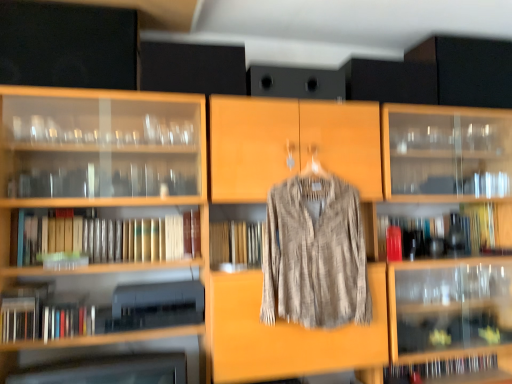
What do you see at coordinates (174, 237) in the screenshot? Image resolution: width=512 pixels, height=384 pixels. I see `white paper book at center, the first book from the left` at bounding box center [174, 237].

Describe the element at coordinates (480, 225) in the screenshot. I see `yellow paperback book at right, which is counted as the 4th book, starting from the bottom` at that location.

Locate an element on the screen. The width and height of the screenshot is (512, 384). wooden book at center, placed as the second book when sorted from bottom to top is located at coordinates (234, 243).

Describe the element at coordinates (315, 254) in the screenshot. I see `textured beige shirt at center` at that location.

What do you see at coordinates (438, 369) in the screenshot? The height and width of the screenshot is (384, 512). I see `hardcover book at lower right, arranged as the fourth book when viewed from the top` at bounding box center [438, 369].

Identify the location of white paper book at center, which ranks as the 2th book in top-to-bottom order. Image resolution: width=512 pixels, height=384 pixels. (174, 237).

From the image's perspective, is wooden bookshelf at lower left positioned above or below wooden book at center, which ranks as the third book in right-to-left order?

wooden bookshelf at lower left is below wooden book at center, which ranks as the third book in right-to-left order.

Which point is more distant from viewer, (20,352) or (228,240)?

The point (228,240) is behind.

Is wooden bookshelf at lower left located outside wooden book at center, the second book from the left?

Yes, wooden bookshelf at lower left is outside of wooden book at center, the second book from the left.

Is wooden bookshelf at lower left wider than wooden book at center, placed as the second book when sorted from bottom to top?

Correct, the width of wooden bookshelf at lower left exceeds that of wooden book at center, placed as the second book when sorted from bottom to top.

From the image's perspective, relative to textured beige shirt at center, is wooden bookshelf at lower left above or below?

Clearly, from the image's perspective, wooden bookshelf at lower left is below textured beige shirt at center.

Are wooden bookshelf at lower left and textured beige shirt at center far apart?

wooden bookshelf at lower left is actually quite close to textured beige shirt at center.

Who is taller, wooden bookshelf at lower left or textured beige shirt at center?

Standing taller between the two is textured beige shirt at center.

Between yellow paperback book at right, the 1th book when ordered from right to left, and white paper book at center, the first book from the left, which one has smaller size?

Smaller between the two is white paper book at center, the first book from the left.

Who is more distant, yellow paperback book at right, the fourth book in the left-to-right sequence, or white paper book at center, the first book from the left?

yellow paperback book at right, the fourth book in the left-to-right sequence.

Considering the relative positions of yellow paperback book at right, the fourth book in the left-to-right sequence, and white paper book at center, the first book from the left, in the image provided, is yellow paperback book at right, the fourth book in the left-to-right sequence, to the left of white paper book at center, the first book from the left, from the viewer's perspective?

In fact, yellow paperback book at right, the fourth book in the left-to-right sequence, is to the right of white paper book at center, the first book from the left.

Is yellow paperback book at right, the 1th book when ordered from top to bottom, oriented away from white paper book at center, arranged as the 4th book when viewed from the right?

yellow paperback book at right, the 1th book when ordered from top to bottom, is not turned away from white paper book at center, arranged as the 4th book when viewed from the right.

Where is `shelf in front of the wooden book at center, the second book from the left`? This screenshot has width=512, height=384. shelf in front of the wooden book at center, the second book from the left is located at coordinates (115, 363).

Is wooden book at center, placed as the second book when sorted from bottom to top, far away from wooden bookshelf at lower left?

Actually, wooden book at center, placed as the second book when sorted from bottom to top, and wooden bookshelf at lower left are a little close together.

From the image's perspective, which is below, wooden book at center, placed as the second book when sorted from bottom to top, or wooden bookshelf at lower left?

wooden bookshelf at lower left.

Which object is wider, wooden book at center, the second book from the left, or wooden bookshelf at lower left?

wooden bookshelf at lower left is wider.

How distant is white paper book at center, the first book from the left, from hardcover book at lower right, which is the 1th book in bottom-to-top order?

white paper book at center, the first book from the left, and hardcover book at lower right, which is the 1th book in bottom-to-top order, are 1.43 meters apart from each other.

Considering the positions of objects white paper book at center, which ranks as the 2th book in top-to-bottom order, and hardcover book at lower right, acting as the second book starting from the right, in the image provided, who is in front, white paper book at center, which ranks as the 2th book in top-to-bottom order, or hardcover book at lower right, acting as the second book starting from the right,?

white paper book at center, which ranks as the 2th book in top-to-bottom order, is in front.

From the image's perspective, is white paper book at center, which ranks as the 2th book in top-to-bottom order, located above or below hardcover book at lower right, acting as the second book starting from the right?

white paper book at center, which ranks as the 2th book in top-to-bottom order, is situated higher than hardcover book at lower right, acting as the second book starting from the right, in the image.

Considering the sizes of objects white paper book at center, which is the 3th book in bottom-to-top order, and hardcover book at lower right, which is the 1th book in bottom-to-top order, in the image provided, who is wider, white paper book at center, which is the 3th book in bottom-to-top order, or hardcover book at lower right, which is the 1th book in bottom-to-top order,?

white paper book at center, which is the 3th book in bottom-to-top order.

Considering the relative sizes of white paper book at center, the first book from the left, and wooden bookshelf at lower left in the image provided, is white paper book at center, the first book from the left, taller than wooden bookshelf at lower left?

No.

Is white paper book at center, which is the 3th book in bottom-to-top order, situated inside wooden bookshelf at lower left or outside?

white paper book at center, which is the 3th book in bottom-to-top order, is located beyond the bounds of wooden bookshelf at lower left.

Can you confirm if white paper book at center, which is the 3th book in bottom-to-top order, is bigger than wooden bookshelf at lower left?

No.

Is white paper book at center, arranged as the 4th book when viewed from the right, with wooden bookshelf at lower left?

No, white paper book at center, arranged as the 4th book when viewed from the right, is not making contact with wooden bookshelf at lower left.

Is wooden book at center, the second book from the left, turned away from white paper book at center, the first book from the left?

No, white paper book at center, the first book from the left, is not at the back of wooden book at center, the second book from the left.

Which of these two, wooden book at center, placed as the second book when sorted from bottom to top, or white paper book at center, arranged as the 4th book when viewed from the right, stands shorter?

With less height is white paper book at center, arranged as the 4th book when viewed from the right.

Is wooden book at center, which ranks as the third book in right-to-left order, not near white paper book at center, the first book from the left?

No.

In terms of width, does wooden book at center, the second book from the left, look wider or thinner when compared to white paper book at center, the first book from the left?

wooden book at center, the second book from the left, is wider than white paper book at center, the first book from the left.

Locate an element on the screen. shelf below the wooden book at center, placed as the second book when sorted from bottom to top (from a real-world perspective) is located at coordinates (115, 363).

Find the location of a particular element. shelf below the textured beige shirt at center (from the image's perspective) is located at coordinates pos(115,363).

Considering their positions, is textured beige shirt at center positioned further to yellow paperback book at right, which is counted as the 4th book, starting from the bottom, than wooden book at center, which ranks as the third book in right-to-left order?

wooden book at center, which ranks as the third book in right-to-left order, is positioned further to the anchor yellow paperback book at right, which is counted as the 4th book, starting from the bottom.

From the image, which object appears to be nearer to wooden bookshelf at lower left, hardcover book at lower right, acting as the second book starting from the right, or textured beige shirt at center?

Among the two, textured beige shirt at center is located nearer to wooden bookshelf at lower left.

Which object lies nearer to the anchor point white paper book at center, arranged as the 4th book when viewed from the right, wooden bookshelf at lower left or textured beige shirt at center?

Based on the image, wooden bookshelf at lower left appears to be nearer to white paper book at center, arranged as the 4th book when viewed from the right.

Considering their positions, is white paper book at center, which is the 3th book in bottom-to-top order, positioned closer to yellow paperback book at right, the 1th book when ordered from right to left, than hardcover book at lower right, which is the 1th book in bottom-to-top order?

hardcover book at lower right, which is the 1th book in bottom-to-top order, is positioned closer to the anchor yellow paperback book at right, the 1th book when ordered from right to left.

When comparing their distances from white paper book at center, which is the 3th book in bottom-to-top order, does textured beige shirt at center or hardcover book at lower right, which ranks as the 3th book in left-to-right order, seem further?

Based on the image, hardcover book at lower right, which ranks as the 3th book in left-to-right order, appears to be further to white paper book at center, which is the 3th book in bottom-to-top order.

Which object lies further to the anchor point white paper book at center, the first book from the left, yellow paperback book at right, which is counted as the 4th book, starting from the bottom, or textured beige shirt at center?

The object further to white paper book at center, the first book from the left, is yellow paperback book at right, which is counted as the 4th book, starting from the bottom.

Estimate the real-world distances between objects in this image. Which object is closer to yellow paperback book at right, the fourth book in the left-to-right sequence, hardcover book at lower right, which ranks as the 3th book in left-to-right order, or wooden bookshelf at lower left?

hardcover book at lower right, which ranks as the 3th book in left-to-right order, is positioned closer to the anchor yellow paperback book at right, the fourth book in the left-to-right sequence.

From the image, which object appears to be nearer to wooden book at center, which is the 3th book in top-to-bottom order, hardcover book at lower right, which is the 1th book in bottom-to-top order, or white paper book at center, which is the 3th book in bottom-to-top order?

white paper book at center, which is the 3th book in bottom-to-top order.

Find the location of a particular element. The image size is (512, 384). clothing between wooden bookshelf at lower left and hardcover book at lower right, which is the 1th book in bottom-to-top order, from left to right is located at coordinates (315, 254).

Find the location of a particular element. The width and height of the screenshot is (512, 384). clothing between white paper book at center, which ranks as the 2th book in top-to-bottom order, and hardcover book at lower right, arranged as the fourth book when viewed from the top, from left to right is located at coordinates (315, 254).

Find the location of a particular element. The width and height of the screenshot is (512, 384). book located between wooden book at center, placed as the second book when sorted from bottom to top, and yellow paperback book at right, the fourth book in the left-to-right sequence, in the left-right direction is located at coordinates (438, 369).

This screenshot has width=512, height=384. I want to click on clothing situated between wooden bookshelf at lower left and yellow paperback book at right, the 1th book when ordered from top to bottom, from left to right, so click(x=315, y=254).